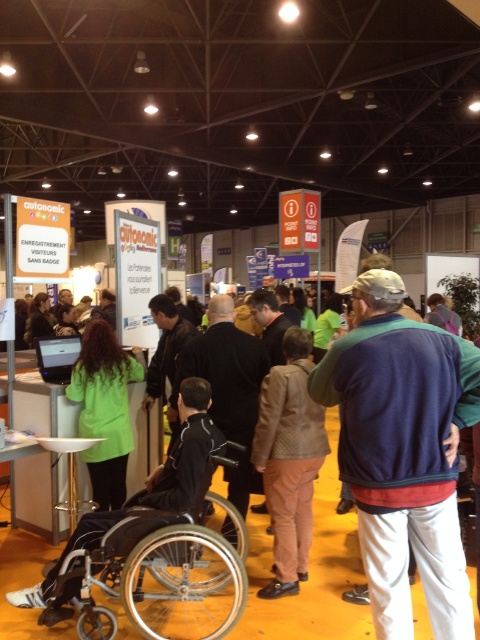
Question: Is dark blue jacket at center behind green matte jacket at center?

Choices:
 (A) no
 (B) yes

Answer: (A)

Question: Which point is closer to the camera taking this photo?

Choices:
 (A) (470, 568)
 (B) (149, 557)
 (C) (69, 396)

Answer: (B)

Question: From the image, what is the correct spatial relationship of silver metallic wheelchair at lower left in relation to green matte jacket at center?

Choices:
 (A) right
 (B) left

Answer: (A)

Question: Does silver metallic wheelchair at lower left appear on the left side of dark blue jacket at center?

Choices:
 (A) yes
 (B) no

Answer: (A)

Question: Which of these objects is positioned closest to the silver metallic wheelchair at lower left?

Choices:
 (A) dark blue jacket at center
 (B) green matte jacket at center

Answer: (A)

Question: Which of the following is the farthest from the observer?

Choices:
 (A) (168, 577)
 (B) (109, 368)

Answer: (B)